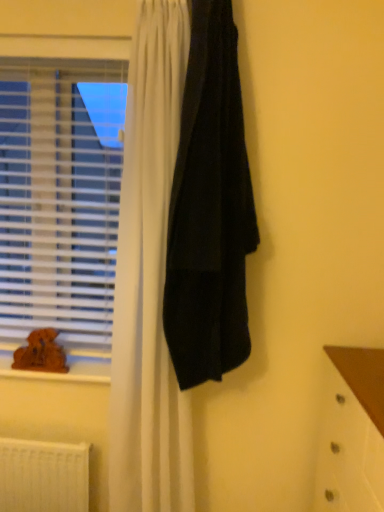
Measure the distance between point (22, 278) and camera.

The distance of point (22, 278) from camera is 1.64 meters.

The width and height of the screenshot is (384, 512). I want to click on brown wood at lower left, so click(63, 373).

You are a GUI agent. You are given a task and a screenshot of the screen. Output one action in this format:
    pyautogui.click(x=<x>, y=<y>)
    Task: Click on the black matte towel at center
    
    Given the screenshot: What is the action you would take?
    pyautogui.click(x=210, y=209)

In order to face black matte towel at center, should I rotate leftwards or rightwards?

You should rotate right by 2.905 degrees.

Locate an element on the screen. The width and height of the screenshot is (384, 512). white plastic blinds at left is located at coordinates (60, 195).

What's the angular difference between brown wood at lower left and brown plush toy at lower left's facing directions?

There is a 1.59-degree angle between the facing directions of brown wood at lower left and brown plush toy at lower left.

This screenshot has height=512, width=384. I want to click on window sill that appears below the brown plush toy at lower left (from a real-world perspective), so click(x=63, y=373).

Considering the points (55, 373) and (48, 370), which point is in front, point (55, 373) or point (48, 370)?

The point (55, 373) is more forward.

Is brown wood at lower left far from brown plush toy at lower left?

No, brown wood at lower left is not far away from brown plush toy at lower left.

Considering the relative positions of black matte towel at center and brown plush toy at lower left in the image provided, is black matte towel at center in front of brown plush toy at lower left?

Yes, black matte towel at center is closer to the camera.

Who is bigger, black matte towel at center or brown plush toy at lower left?

With larger size is black matte towel at center.

From the picture: Measure the distance from black matte towel at center to brown plush toy at lower left.

black matte towel at center and brown plush toy at lower left are 69.71 centimeters apart from each other.

Are black matte towel at center and brown plush toy at lower left beside each other?

No, black matte towel at center is not in contact with brown plush toy at lower left.

In terms of width, does black matte towel at center look wider or thinner when compared to white plastic blinds at left?

black matte towel at center is wider than white plastic blinds at left.

Does point (222, 312) appear closer or farther from the camera than point (79, 173)?

Point (222, 312) appears to be closer to the viewer than point (79, 173).

At what (x,y) coordinates should I click in order to perform the action: click on towel in front of the white plastic blinds at left. Please return your answer as a coordinate pair (x, y). Looking at the image, I should click on (210, 209).

Looking at this image, considering the relative positions of brown plush toy at lower left and black matte towel at center in the image provided, is brown plush toy at lower left to the right of black matte towel at center from the viewer's perspective?

Incorrect, brown plush toy at lower left is not on the right side of black matte towel at center.

In the scene shown: Is brown plush toy at lower left far away from black matte towel at center?

That's not correct — brown plush toy at lower left is a little close to black matte towel at center.

Is brown plush toy at lower left in front of black matte towel at center?

No.

Considering the positions of point (54, 116) and point (86, 481), is point (54, 116) closer or farther from the camera than point (86, 481)?

Point (54, 116) is positioned farther from the camera compared to point (86, 481).

Is white plastic radiator at lower left inside white plastic blinds at left?

No.

From the image's perspective, does white plastic blinds at left appear lower than white plastic radiator at lower left?

Incorrect, from the image's perspective, white plastic blinds at left is higher than white plastic radiator at lower left.

Considering the positions of objects white plastic blinds at left and brown plush toy at lower left in the image provided, who is more to the right, white plastic blinds at left or brown plush toy at lower left?

white plastic blinds at left is more to the right.

From the picture: Is white plastic blinds at left in contact with brown plush toy at lower left?

No, white plastic blinds at left is not with brown plush toy at lower left.

Which of these two, white plastic blinds at left or brown plush toy at lower left, is bigger?

Bigger between the two is white plastic blinds at left.

Would you say white plastic blinds at left is inside or outside brown plush toy at lower left?

white plastic blinds at left is not enclosed by brown plush toy at lower left.

Is black matte towel at center taller or shorter than brown wood at lower left?

black matte towel at center is taller than brown wood at lower left.

Is black matte towel at center placed right next to brown wood at lower left?

They are not placed beside each other.

Image resolution: width=384 pixels, height=512 pixels. In order to click on window sill that is below the black matte towel at center (from the image's perspective) in this screenshot , I will do `click(63, 373)`.

Could you tell me if black matte towel at center is facing brown wood at lower left?

No, black matte towel at center is not turned towards brown wood at lower left.

I want to click on window sill behind the brown plush toy at lower left, so click(63, 373).

Locate an element on the screen. The height and width of the screenshot is (512, 384). towel located above the brown plush toy at lower left (from the image's perspective) is located at coordinates (210, 209).

When comparing their distances from black matte towel at center, does brown wood at lower left or white plastic radiator at lower left seem further?

white plastic radiator at lower left lies further to black matte towel at center than the other object.

From the picture: Looking at the image, which one is located closer to brown wood at lower left, brown plush toy at lower left or white plastic blinds at left?

Based on the image, brown plush toy at lower left appears to be nearer to brown wood at lower left.

Considering their positions, is brown wood at lower left positioned further to brown plush toy at lower left than white plastic radiator at lower left?

Among the two, white plastic radiator at lower left is located further to brown plush toy at lower left.

From the image, which object appears to be farther from white plastic blinds at left, white plastic radiator at lower left or black matte towel at center?

Based on the image, white plastic radiator at lower left appears to be further to white plastic blinds at left.

Considering their positions, is white plastic radiator at lower left positioned further to brown plush toy at lower left than white plastic blinds at left?

The object further to brown plush toy at lower left is white plastic blinds at left.

Based on their spatial positions, is brown plush toy at lower left or white plastic radiator at lower left closer to black matte towel at center?

Based on the image, brown plush toy at lower left appears to be nearer to black matte towel at center.

When comparing their distances from white plastic radiator at lower left, does brown wood at lower left or white plastic blinds at left seem closer?

brown wood at lower left lies closer to white plastic radiator at lower left than the other object.

From the image, which object appears to be farther from white plastic radiator at lower left, brown wood at lower left or brown plush toy at lower left?

Among the two, brown plush toy at lower left is located further to white plastic radiator at lower left.

Identify the location of window sill between black matte towel at center and white plastic radiator at lower left from top to bottom. (63, 373).

This screenshot has width=384, height=512. In order to click on animal between white plastic blinds at left and brown wood at lower left from top to bottom in this screenshot , I will do `click(41, 353)`.

I want to click on window sill between brown plush toy at lower left and white plastic radiator at lower left in the up-down direction, so click(x=63, y=373).

In order to click on animal that lies between black matte towel at center and white plastic radiator at lower left from top to bottom in this screenshot , I will do `click(41, 353)`.